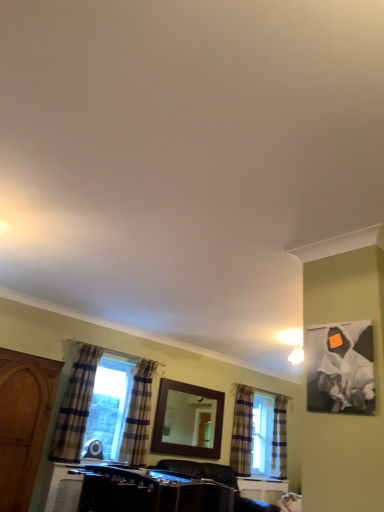
Question: From a real-world perspective, is plaid fabric curtain at right, the second curtain in the right-to-left sequence, positioned above or below plaid fabric curtain at lower left, acting as the 2th curtain starting from the front?

Choices:
 (A) below
 (B) above

Answer: (B)

Question: Considering their positions, is plaid fabric curtain at right, the 2th curtain from the back, located in front of or behind plaid fabric curtain at lower left, arranged as the third curtain when viewed from the back?

Choices:
 (A) front
 (B) behind

Answer: (B)

Question: Estimate the real-world distances between objects in this image. Which object is farther from the black glossy vanity at lower center?

Choices:
 (A) plaid fabric curtain at right, acting as the 1th curtain starting from the right
 (B) wooden mirror at center
 (C) plaid fabric curtain at right, the 2th curtain from the back
 (D) plaid fabric curtain at lower left, arranged as the third curtain when viewed from the back
 (E) plaid fabric curtain at left, the 1th curtain positioned from the left

Answer: (A)

Question: Based on their relative distances, which object is farther from the plaid fabric curtain at right, the 2th curtain from the back?

Choices:
 (A) wooden cabinet at left
 (B) black glossy vanity at lower center
 (C) black canvas painting at upper right
 (D) wooden mirror at center
 (E) plaid fabric curtain at left, which is the 4th curtain in back-to-front order

Answer: (C)